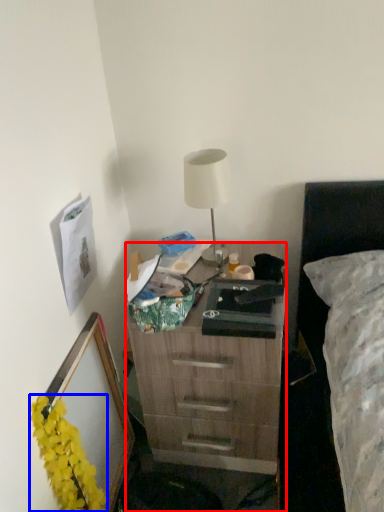
Question: Which object appears closest to the camera in this image, desk (highlighted by a red box) or flower (highlighted by a blue box)?

Choices:
 (A) desk
 (B) flower

Answer: (B)